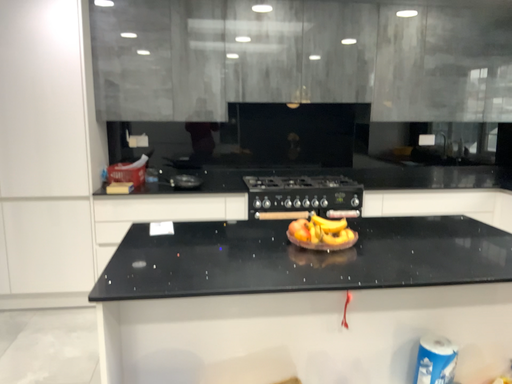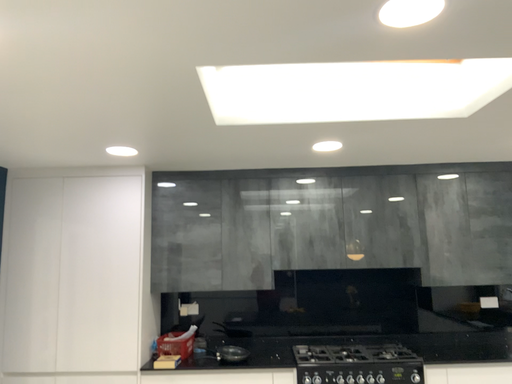
Question: Which way did the camera rotate in the video?

Choices:
 (A) rotated upward
 (B) rotated downward

Answer: (A)